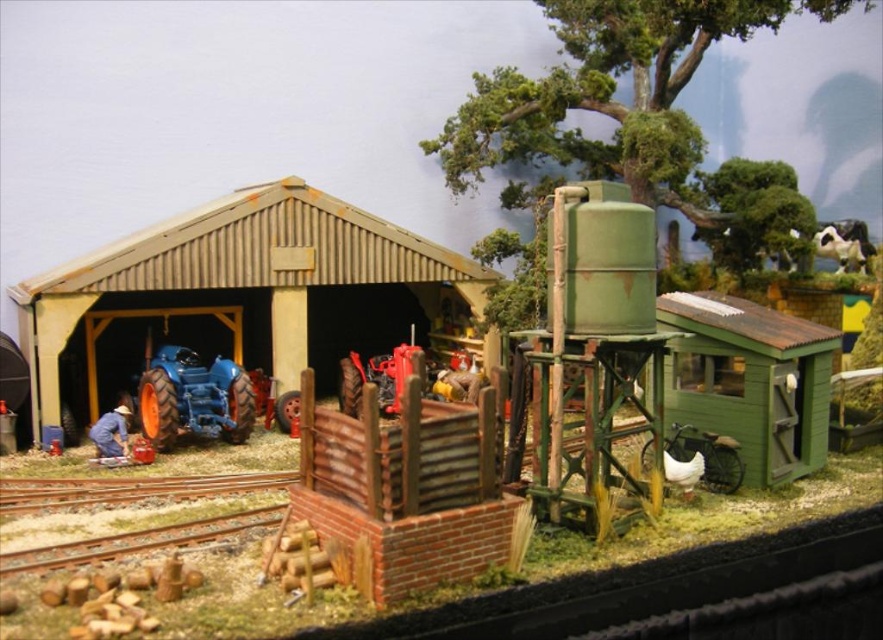
Question: Can you confirm if rustic wood shed at center is positioned below rusty metal tracks at lower left?

Choices:
 (A) no
 (B) yes

Answer: (A)

Question: Which of these objects is positioned farthest from the green matte water tower at upper right?

Choices:
 (A) matte blue tractor at center-left
 (B) black and white fur at upper right

Answer: (B)

Question: Estimate the real-world distances between objects in this image. Which object is farther from the matte blue tractor at center-left?

Choices:
 (A) green matte water tower at upper right
 (B) rustic wood shed at center
 (C) rusty metal tracks at lower left
 (D) smooth metal tracks at lower left

Answer: (A)

Question: Does green matte shed at right lie behind black and white fur at upper right?

Choices:
 (A) yes
 (B) no

Answer: (B)

Question: Is rustic wood shed at center wider than smooth metal tracks at lower left?

Choices:
 (A) yes
 (B) no

Answer: (A)

Question: Which point is closer to the camera taking this photo?

Choices:
 (A) (194, 522)
 (B) (590, 266)

Answer: (A)